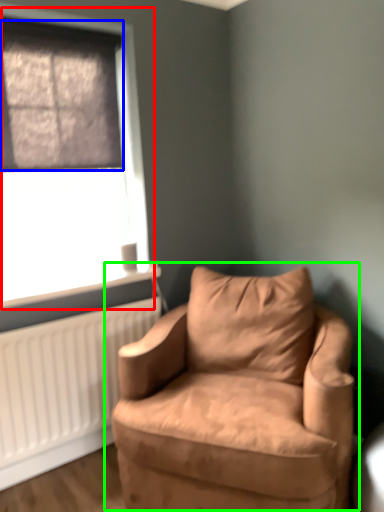
Question: Considering the real-world distances, which object is closest to window (highlighted by a red box)? window screen (highlighted by a blue box) or chair (highlighted by a green box).

Choices:
 (A) window screen
 (B) chair

Answer: (A)